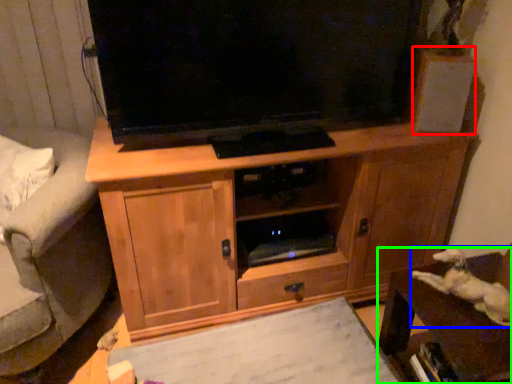
Question: Which is farther away from speaker (highlighted by a red box)? animal (highlighted by a blue box) or furniture (highlighted by a green box)?

Choices:
 (A) animal
 (B) furniture

Answer: (B)